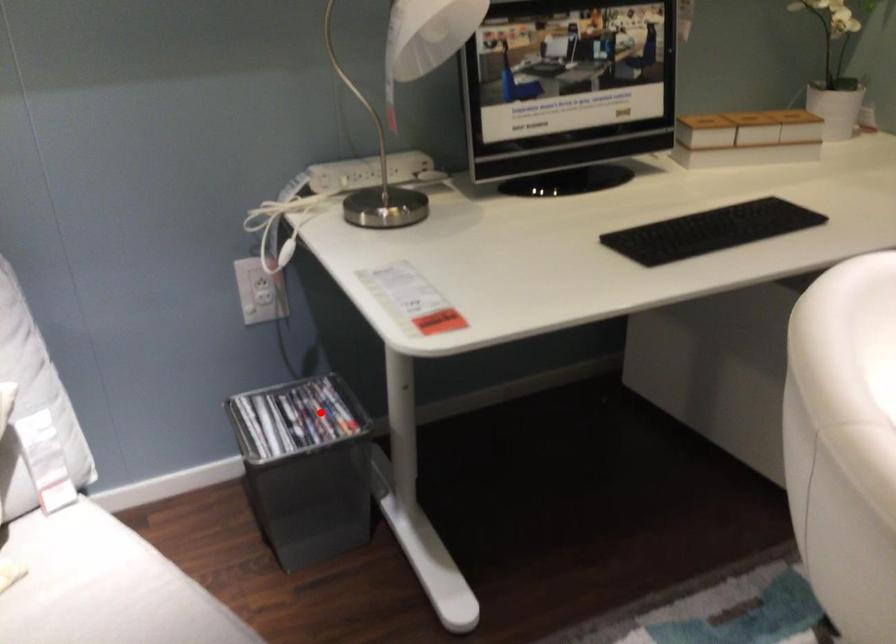
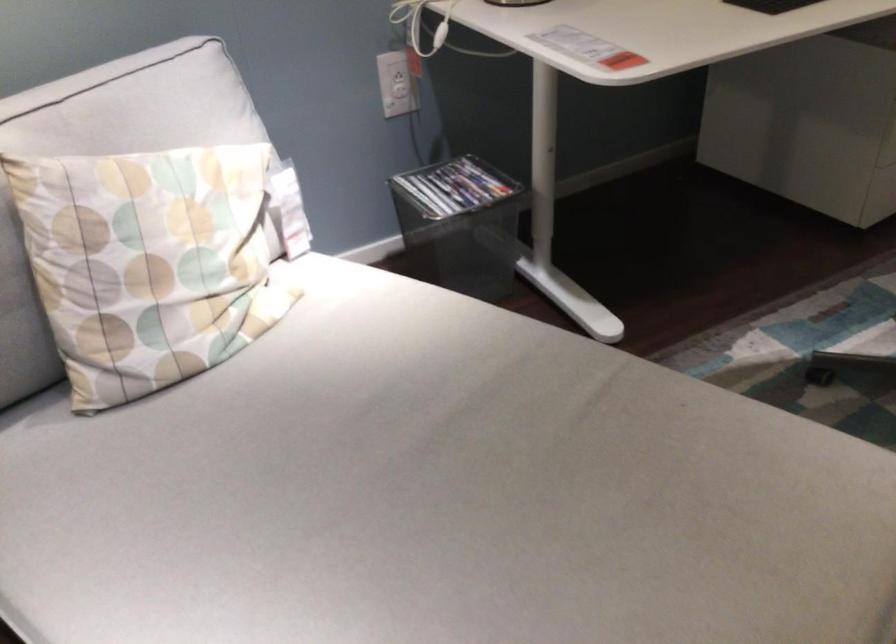
Question: I am providing you with two images of the same scene from different viewpoints. A red point is shown in image1. For the corresponding object point in image2, is it positioned nearer or farther from the camera?

Choices:
 (A) Nearer
 (B) Farther

Answer: (B)